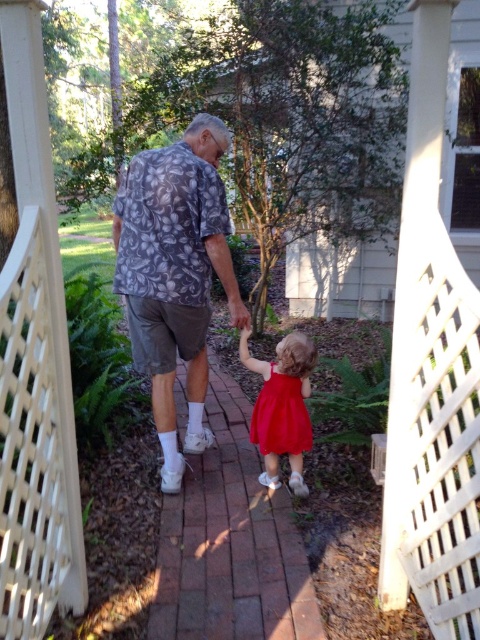
You are a photographer standing at the camera position. You want to capture a closeup shot of the red satin dress at center. Considering the distance, do you think you can focus on it clearly without moving closer?

The red satin dress at center is 6.54 feet away from camera, which is within a typical camera focusing range. Therefore, you can focus on it clearly without moving closer.

You are a photographer capturing this moment. You notice the floral fabric shirt at center and the matte red dress at center. Which clothing item is positioned higher on the person in the scene?

The floral fabric shirt at center is located above the matte red dress at center, so the floral fabric shirt at center is positioned higher.